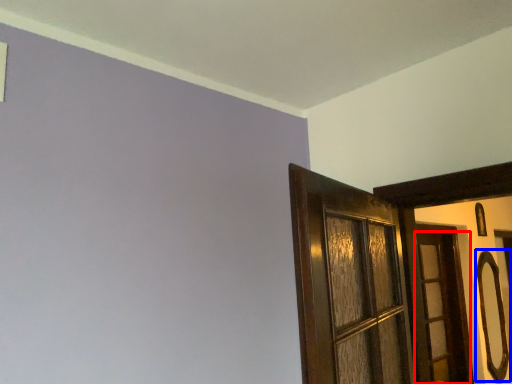
Question: Which point is further to the camera, door (highlighted by a red box) or door handle (highlighted by a blue box)?

Choices:
 (A) door
 (B) door handle

Answer: (B)